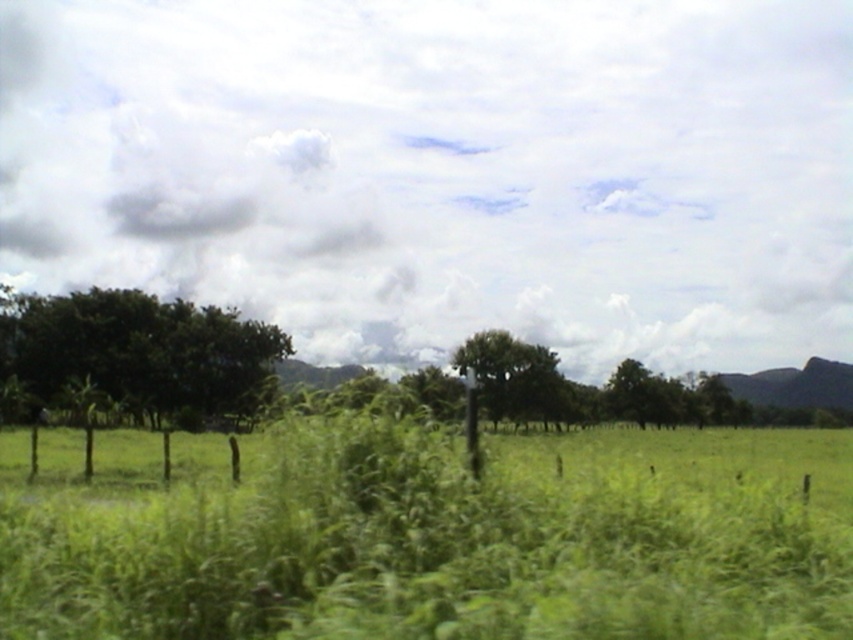
Who is taller, green grass at center or green leafy tree at left?

With more height is green leafy tree at left.

In the scene shown: Can you confirm if green grass at center is wider than green leafy tree at left?

Yes.

Find the location of a particular element. The height and width of the screenshot is (640, 853). green grass at center is located at coordinates (451, 547).

Which of these two, green grass at center or green leafy tree at center, stands shorter?

green grass at center

Can you confirm if green grass at center is positioned to the right of green leafy tree at center?

In fact, green grass at center is to the left of green leafy tree at center.

Is point (444, 509) closer to camera compared to point (535, 410)?

Yes.

Find the location of `green grass at center`. green grass at center is located at coordinates (451, 547).

Describe the element at coordinates (138, 352) in the screenshot. I see `green leafy tree at left` at that location.

Does green leafy tree at left appear over green leafy tree at center?

Indeed, green leafy tree at left is positioned over green leafy tree at center.

Between point (160, 317) and point (524, 380), which one is positioned in front?

Point (160, 317) is in front.

I want to click on green leafy tree at left, so click(x=138, y=352).